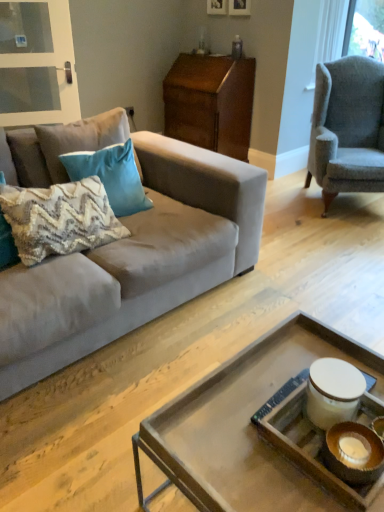
Question: Is the depth of textured beige pillow at left, marked as the 3th pillow in a back-to-front arrangement, less than that of wooden picture frame at upper center, which appears as the 1th picture frame when viewed from the left?

Choices:
 (A) yes
 (B) no

Answer: (A)

Question: Does textured beige pillow at left, which is the 1th pillow from front to back, appear on the left side of wooden picture frame at upper center, which appears as the 1th picture frame when viewed from the left?

Choices:
 (A) yes
 (B) no

Answer: (A)

Question: From a real-world perspective, is textured beige pillow at left, which is the 1th pillow from front to back, below wooden picture frame at upper center, placed as the second picture frame when sorted from right to left?

Choices:
 (A) yes
 (B) no

Answer: (A)

Question: Can you confirm if textured beige pillow at left, marked as the 3th pillow in a back-to-front arrangement, is smaller than wooden picture frame at upper center, which appears as the 1th picture frame when viewed from the left?

Choices:
 (A) yes
 (B) no

Answer: (B)

Question: Does textured beige pillow at left, which is the 1th pillow from front to back, contain wooden picture frame at upper center, placed as the second picture frame when sorted from right to left?

Choices:
 (A) yes
 (B) no

Answer: (B)

Question: Is wooden picture frame at upper center, which appears as the 1th picture frame when viewed from the left, wider or thinner than teal velvet pillow at upper left, which ranks as the 2th pillow in front-to-back order?

Choices:
 (A) thin
 (B) wide

Answer: (A)

Question: In the image, is wooden picture frame at upper center, placed as the second picture frame when sorted from right to left, positioned in front of or behind teal velvet pillow at upper left, which ranks as the 2th pillow in front-to-back order?

Choices:
 (A) behind
 (B) front

Answer: (A)

Question: Is point (215, 10) closer or farther from the camera than point (127, 185)?

Choices:
 (A) closer
 (B) farther

Answer: (B)

Question: Is wooden picture frame at upper center, placed as the second picture frame when sorted from right to left, taller or shorter than teal velvet pillow at upper left, which ranks as the 2th pillow in front-to-back order?

Choices:
 (A) short
 (B) tall

Answer: (A)

Question: In terms of size, does clear glass screen door at upper left appear bigger or smaller than suede couch at left?

Choices:
 (A) big
 (B) small

Answer: (B)

Question: Does point (49, 109) appear closer or farther from the camera than point (160, 256)?

Choices:
 (A) closer
 (B) farther

Answer: (B)

Question: Would you say clear glass screen door at upper left is to the left or to the right of suede couch at left in the picture?

Choices:
 (A) left
 (B) right

Answer: (A)

Question: Is clear glass screen door at upper left taller or shorter than suede couch at left?

Choices:
 (A) tall
 (B) short

Answer: (B)

Question: Is clear glass screen door at upper left in front of or behind teal velvet pillow at upper left, which ranks as the 2th pillow in front-to-back order, in the image?

Choices:
 (A) front
 (B) behind

Answer: (B)

Question: Based on their positions, is clear glass screen door at upper left located to the left or right of teal velvet pillow at upper left, which ranks as the 2th pillow in front-to-back order?

Choices:
 (A) right
 (B) left

Answer: (B)